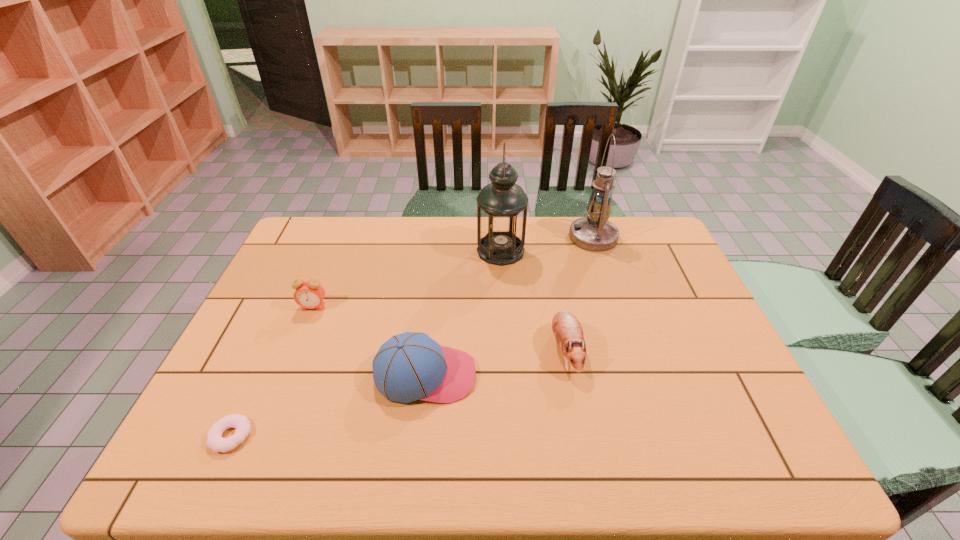
This screenshot has width=960, height=540. I want to click on free space at the right edge, so click(x=736, y=413).

Locate an element on the screen. The width and height of the screenshot is (960, 540). free space at the far left corner of the desktop is located at coordinates (327, 231).

Where is `vacant region at the far right corner`? The height and width of the screenshot is (540, 960). vacant region at the far right corner is located at coordinates (660, 241).

Locate an element on the screen. vacant space that's between the third farthest object and the right oil lamp is located at coordinates (453, 272).

You are a GUI agent. You are given a task and a screenshot of the screen. Output one action in this format:
    pyautogui.click(x=<x>, y=<y>)
    Task: Click on the empty location between the left oil lamp and the right oil lamp
    The image size is (960, 540).
    Given the screenshot: What is the action you would take?
    pyautogui.click(x=547, y=244)

Image resolution: width=960 pixels, height=540 pixels. What are the coordinates of `vacant space in between the baseball cap and the right oil lamp` in the screenshot? It's located at (510, 306).

This screenshot has height=540, width=960. I want to click on free space between the second object from right to left and the baseball cap, so click(495, 362).

This screenshot has height=540, width=960. What are the coordinates of `empty space between the rightmost object and the left oil lamp` in the screenshot? It's located at (547, 244).

Identify the location of vacant region between the left oil lamp and the second object from right to left. This screenshot has height=540, width=960. (533, 300).

Identify the location of empty space between the alarm clock and the rightmost object. (453, 272).